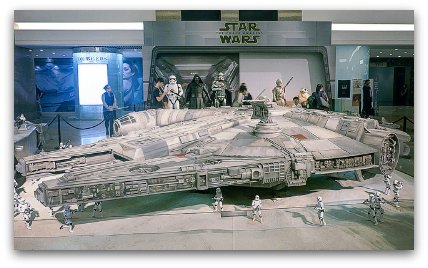
Find the location of a particular element. wall is located at coordinates (353, 60).